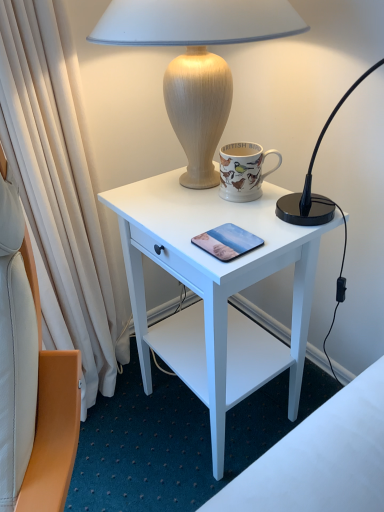
Where is `free point above white matte desk at center (from a real-world perspective)`? free point above white matte desk at center (from a real-world perspective) is located at coordinates (214, 206).